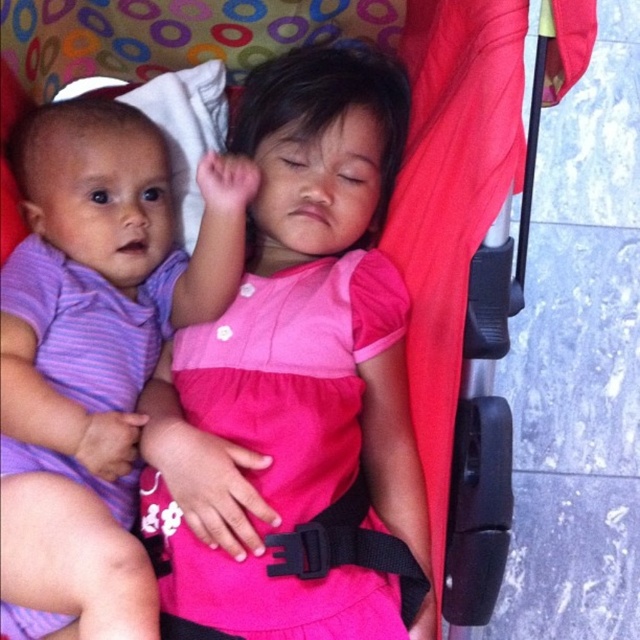
You are a photographer standing 30 inches away from the camera. You want to take a photo of the children in the stroller. Can you safely step forward to get a closer shot without getting too close to the pink fabric dress at center?

The pink fabric dress at center is 29.67 inches away from the camera. Since you are already 30 inches away, stepping forward would bring you closer than the safe distance. You should stay at your current position to avoid getting too close.

You are a photographer taking a picture of the two children in the stroller. You notice the pink fabric dress at center and the purple striped fabric at left. Which fabric is positioned higher in the image?

The pink fabric dress at center is positioned higher than the purple striped fabric at left.

You are a photographer trying to capture a closeup of the pink fabric dress at center and the purple striped fabric at left. Which fabric should you focus on first if you want to ensure both are in frame without moving the camera?

The purple striped fabric at left is closer to the camera than the pink fabric dress at center, so you should focus on the purple striped fabric at left first to ensure both are in frame without moving the camera.